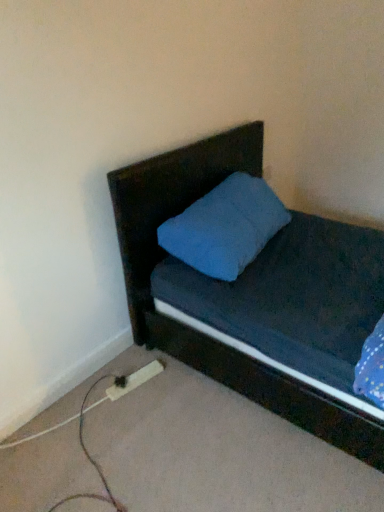
The height and width of the screenshot is (512, 384). I want to click on unoccupied space behind wooden extension cord at lower left, so click(x=130, y=358).